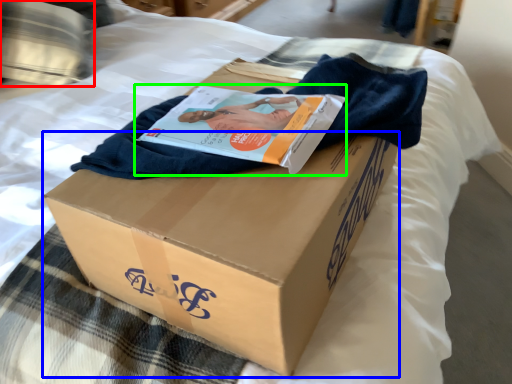
Question: Based on their relative distances, which object is nearer to pillow (highlighted by a red box)? Choose from cardboard box (highlighted by a blue box) and magazine (highlighted by a green box).

Choices:
 (A) cardboard box
 (B) magazine

Answer: (B)